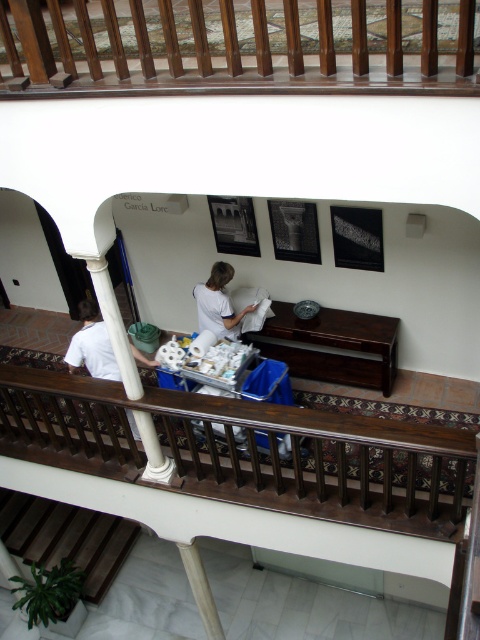
Who is lower down, wooden railing at upper center or wooden stairs at lower left?

wooden stairs at lower left is below.

Is wooden railing at upper center wider than wooden stairs at lower left?

Correct, the width of wooden railing at upper center exceeds that of wooden stairs at lower left.

Which is in front, point (166, 45) or point (108, 545)?

Point (166, 45) is more forward.

Identify the location of wooden railing at upper center. (237, 45).

Does dark wood table at center lie in front of white cotton shirt at center?

No, dark wood table at center is further to the viewer.

Is point (343, 348) positioned before point (220, 310)?

No, it is not.

Is point (303, 352) positioned behind point (218, 337)?

Yes, point (303, 352) is farther from viewer.

Identify the location of dark wood table at center. Image resolution: width=480 pixels, height=640 pixels. (332, 346).

Does wooden railing at upper center appear on the right side of white cotton shirt at center?

Incorrect, wooden railing at upper center is not on the right side of white cotton shirt at center.

Is wooden railing at upper center shorter than white cotton shirt at center?

In fact, wooden railing at upper center may be taller than white cotton shirt at center.

Does point (105, 76) come behind point (220, 314)?

No.

The height and width of the screenshot is (640, 480). Identify the location of wooden railing at upper center. (237, 45).